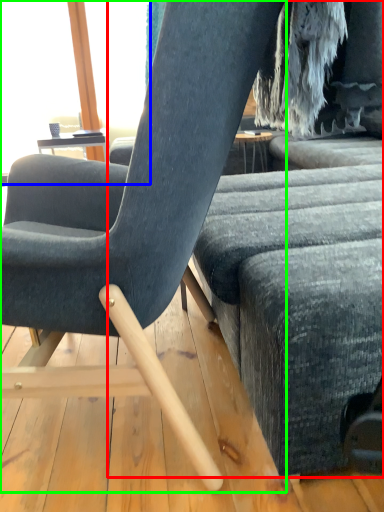
Question: Considering the real-world distances, which object is farthest from studio couch (highlighted by a red box)? window screen (highlighted by a blue box) or chair (highlighted by a green box)?

Choices:
 (A) window screen
 (B) chair

Answer: (A)